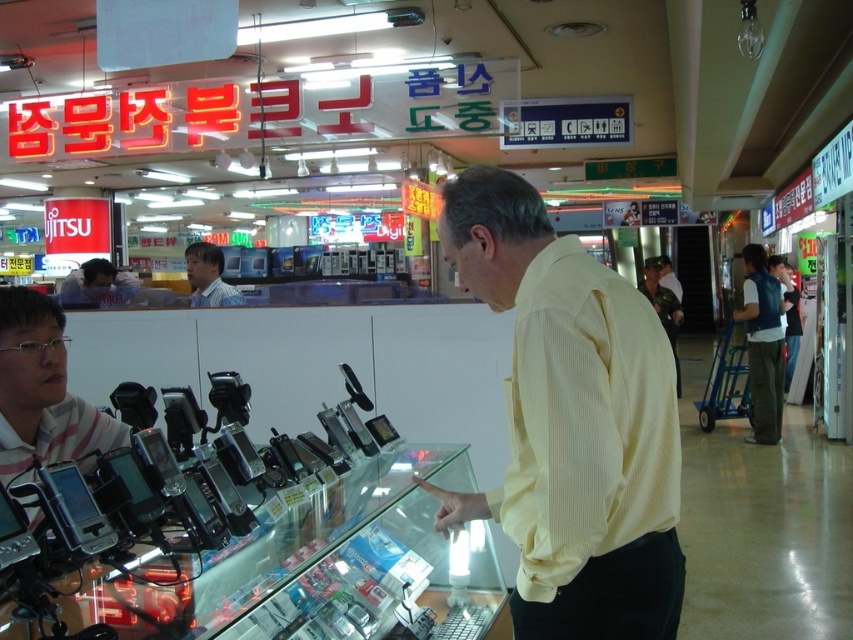
Question: Which point is farther to the camera?

Choices:
 (A) striped cotton shirt at left
 (B) yellow striped shirt at center

Answer: (A)

Question: Which point is farther to the camera?

Choices:
 (A) camouflage fabric shirt at center
 (B) striped cotton shirt at left
 (C) yellow striped shirt at center
 (D) light blue shirt at left

Answer: (D)

Question: Is blue denim vest at right to the left of camouflage fabric shirt at center from the viewer's perspective?

Choices:
 (A) yes
 (B) no

Answer: (B)

Question: Does striped cotton shirt at left have a greater width compared to camouflage fabric shirt at center?

Choices:
 (A) no
 (B) yes

Answer: (A)

Question: Can you confirm if yellow striped shirt at center is wider than camouflage fabric shirt at center?

Choices:
 (A) no
 (B) yes

Answer: (A)

Question: Which is nearer to the camouflage fabric shirt at center?

Choices:
 (A) blue denim vest at right
 (B) yellow striped shirt at center

Answer: (B)